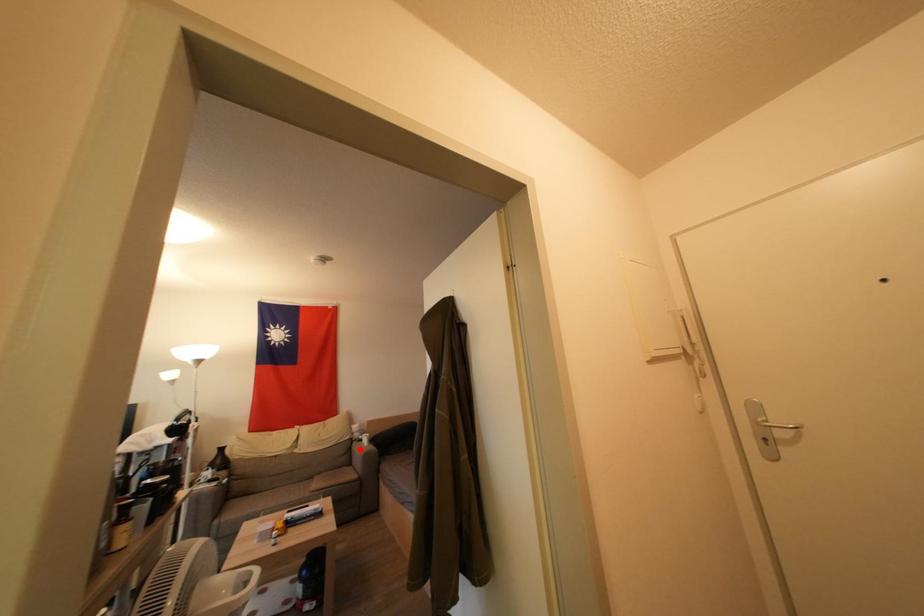
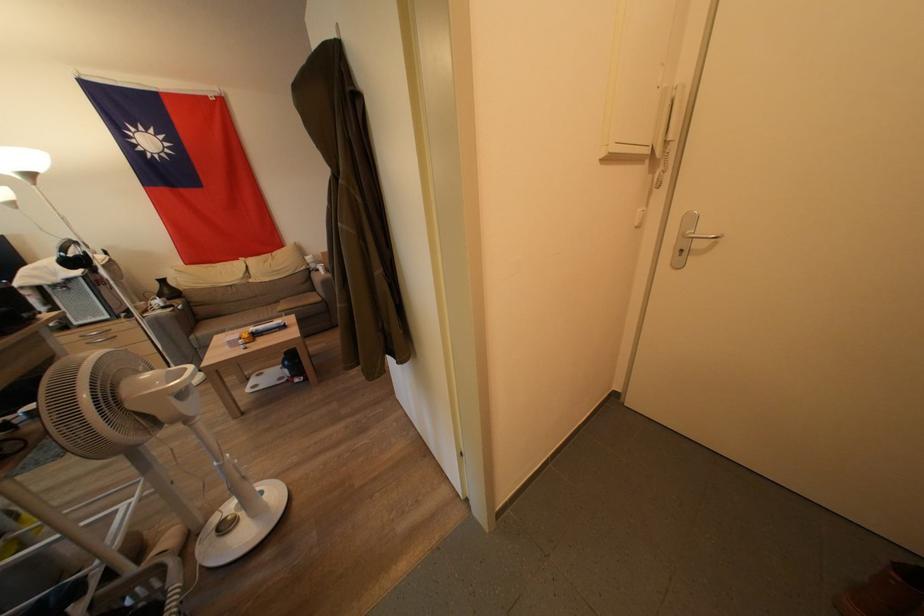
Where in the second image is the point corresponding to the highlighted location from the first image?

(319, 278)